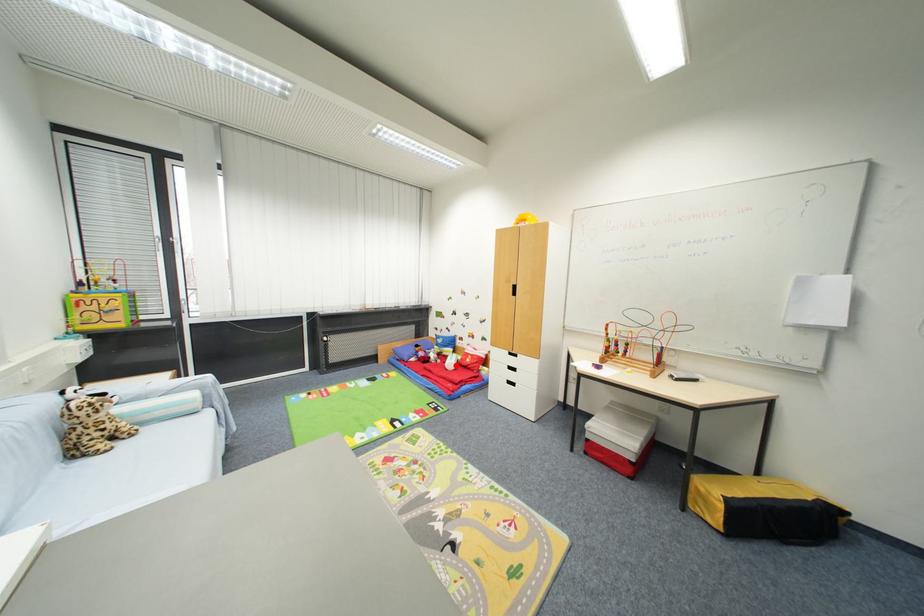
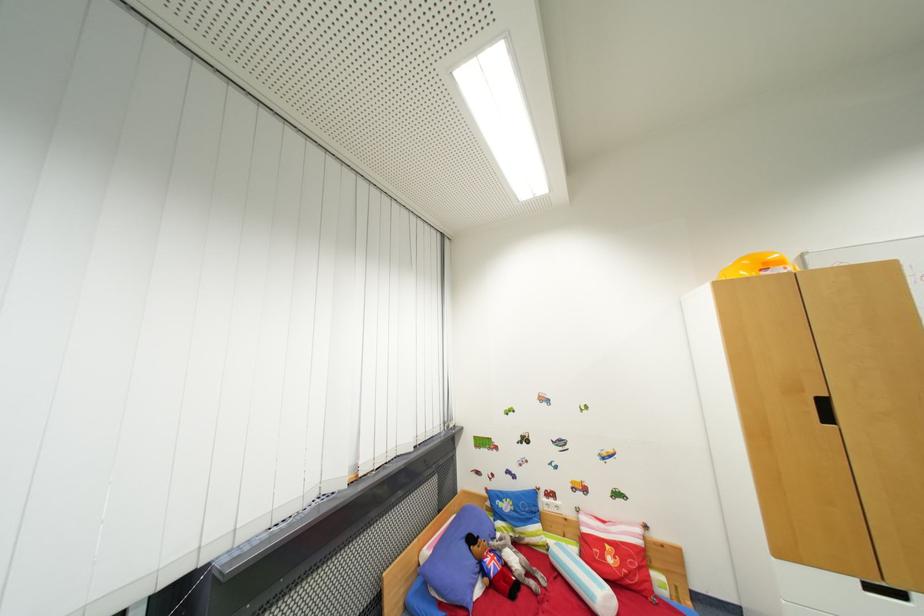
Question: I am providing you with two images of the same scene from different viewpoints. A red point is marked on the first image. Is the red point's position out of view in image 2?

Choices:
 (A) Yes
 (B) No

Answer: (B)